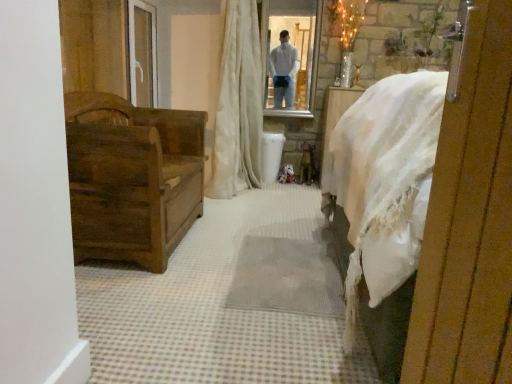
Question: Is there a large distance between wooden chest at left and white textured curtain at center?

Choices:
 (A) no
 (B) yes

Answer: (B)

Question: Is wooden chest at left to the left of white textured curtain at center from the viewer's perspective?

Choices:
 (A) no
 (B) yes

Answer: (B)

Question: Is wooden chest at left further to the viewer compared to white textured curtain at center?

Choices:
 (A) no
 (B) yes

Answer: (A)

Question: Can you confirm if wooden chest at left is wider than white textured curtain at center?

Choices:
 (A) no
 (B) yes

Answer: (B)

Question: From a real-world perspective, is wooden chest at left on top of white textured curtain at center?

Choices:
 (A) yes
 (B) no

Answer: (B)

Question: Is clear glass mirror at upper center inside the boundaries of dark brown wood chest at left, or outside?

Choices:
 (A) outside
 (B) inside

Answer: (A)

Question: Does point (302, 36) appear closer or farther from the camera than point (198, 195)?

Choices:
 (A) farther
 (B) closer

Answer: (A)

Question: Visually, is clear glass mirror at upper center positioned to the left or to the right of dark brown wood chest at left?

Choices:
 (A) right
 (B) left

Answer: (A)

Question: In terms of size, does clear glass mirror at upper center appear bigger or smaller than dark brown wood chest at left?

Choices:
 (A) small
 (B) big

Answer: (A)

Question: From the image's perspective, is wooden chest at left positioned above or below dark brown wood chest at left?

Choices:
 (A) below
 (B) above

Answer: (A)

Question: From a real-world perspective, is wooden chest at left above or below dark brown wood chest at left?

Choices:
 (A) above
 (B) below

Answer: (B)

Question: Is wooden chest at left bigger or smaller than dark brown wood chest at left?

Choices:
 (A) small
 (B) big

Answer: (A)

Question: Visually, is wooden chest at left positioned to the left or to the right of dark brown wood chest at left?

Choices:
 (A) left
 (B) right

Answer: (B)

Question: From a real-world perspective, is dark brown wood chest at left above or below white textured curtain at center?

Choices:
 (A) above
 (B) below

Answer: (B)

Question: Is dark brown wood chest at left wider or thinner than white textured curtain at center?

Choices:
 (A) thin
 (B) wide

Answer: (B)